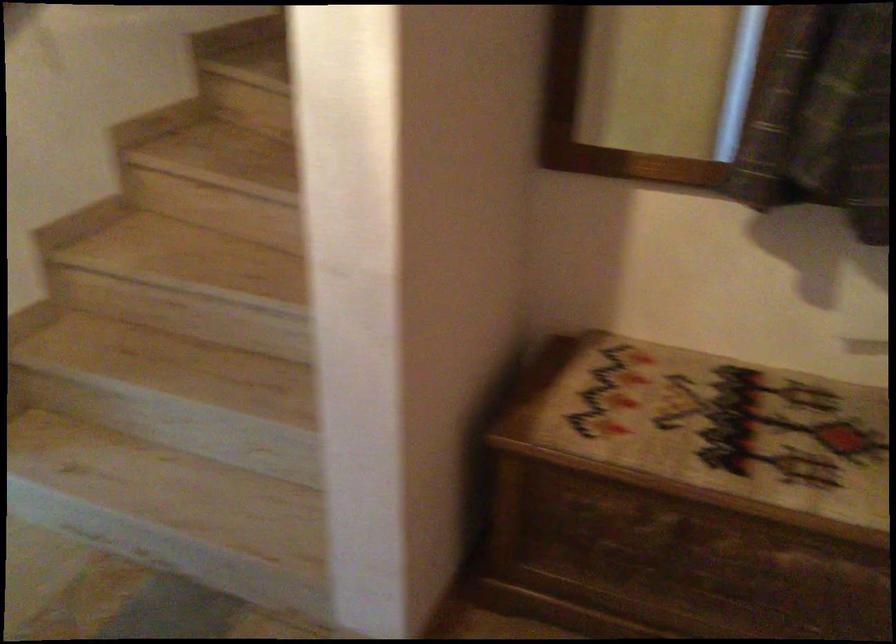
Identify the location of wooden chest lid. The width and height of the screenshot is (896, 644). 709,431.